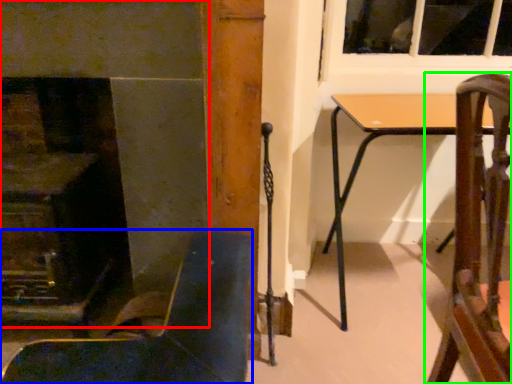
Question: Which object is the farthest from fireplace (highlighted by a red box)? Choose among these: chair (highlighted by a blue box) or chair (highlighted by a green box).

Choices:
 (A) chair
 (B) chair

Answer: (B)